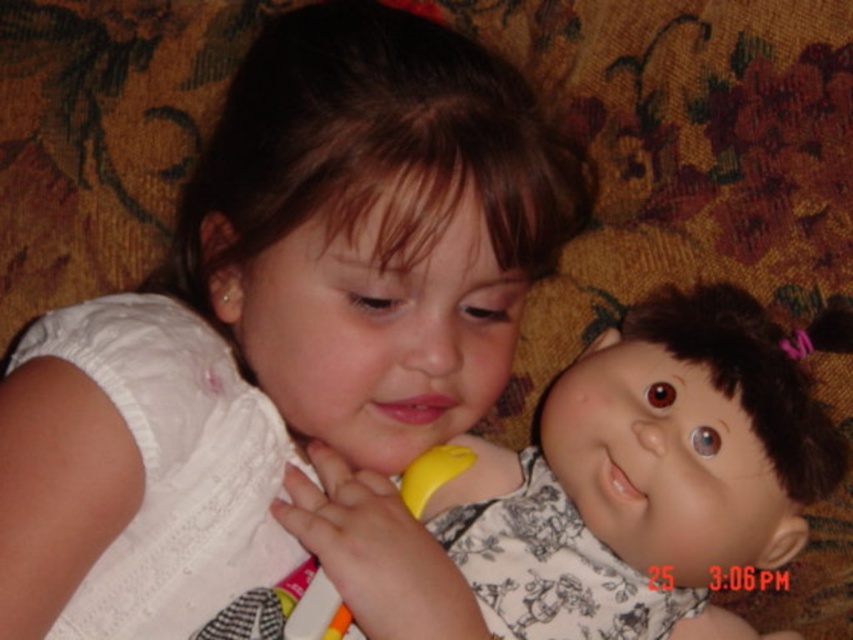
You are a photographer trying to capture a closeup of the white fabric dress at center. The camera is currently positioned 20.17 inches away. Is the distance sufficient for a clear closeup shot?

The white fabric dress at center and camera are 20.17 inches apart from each other, so the distance is sufficient for a clear closeup shot as the camera is positioned at the required distance.

You are a photographer trying to capture the scene where the child is interacting with the doll. To ensure the white fabric dress at center and the smooth plastic doll at center are both visible in the frame, which object should you focus on first?

You should focus on the smooth plastic doll at center first because the white fabric dress at center is located above it, so focusing on the lower object ensures both will be in focus.

Please look at the image and identify the object located at point (294, 289). Choose from the following options based on the scene description provided. The options are the white fabric dress at center, the yellow toy phone, or the doll.

The white fabric dress at center is located at point (294, 289).